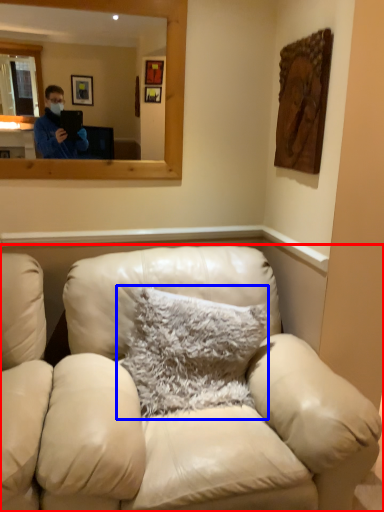
Question: Which object is closer to the camera taking this photo, studio couch (highlighted by a red box) or pillow (highlighted by a blue box)?

Choices:
 (A) studio couch
 (B) pillow

Answer: (A)